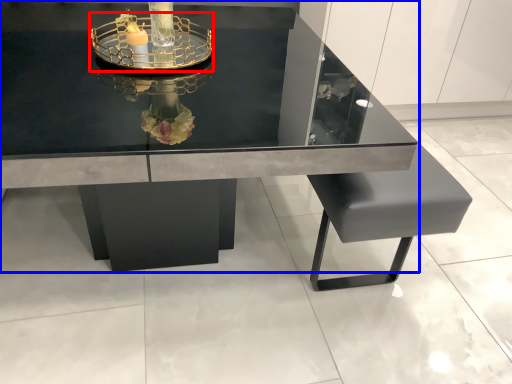
Question: Which point is closer to the camera, glass box (highlighted by a red box) or table (highlighted by a blue box)?

Choices:
 (A) glass box
 (B) table

Answer: (B)